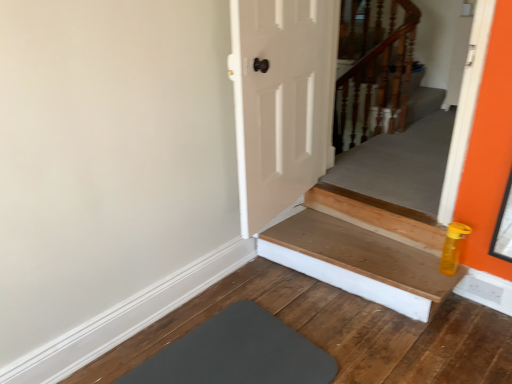
Question: In the image, is wooden at upper right positioned in front of or behind gray rubber mat at lower left?

Choices:
 (A) front
 (B) behind

Answer: (B)

Question: Considering the positions of wooden at upper right and gray rubber mat at lower left in the image, is wooden at upper right taller or shorter than gray rubber mat at lower left?

Choices:
 (A) tall
 (B) short

Answer: (A)

Question: Which is nearer to the wooden at bottom?

Choices:
 (A) wooden at upper right
 (B) gray rubber mat at lower left

Answer: (B)

Question: Estimate the real-world distances between objects in this image. Which object is farther from the wooden at upper right?

Choices:
 (A) gray rubber mat at lower left
 (B) wooden at bottom

Answer: (A)